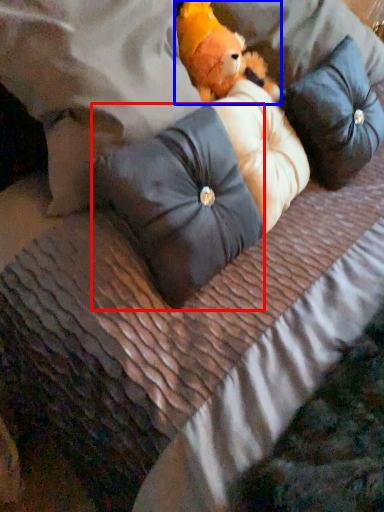
Question: Which object is closer to the camera taking this photo, pillow (highlighted by a red box) or teddy bear (highlighted by a blue box)?

Choices:
 (A) pillow
 (B) teddy bear

Answer: (A)